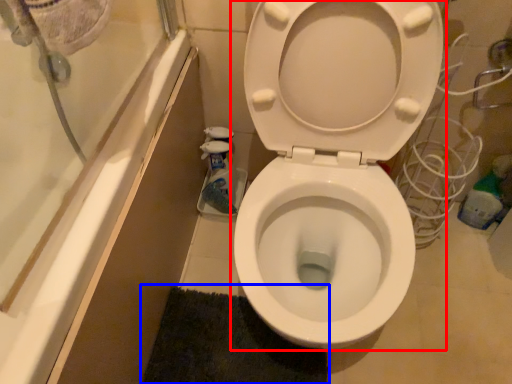
Question: Which of the following is the closest to the observer, toilet (highlighted by a red box) or bath mat (highlighted by a blue box)?

Choices:
 (A) toilet
 (B) bath mat

Answer: (A)